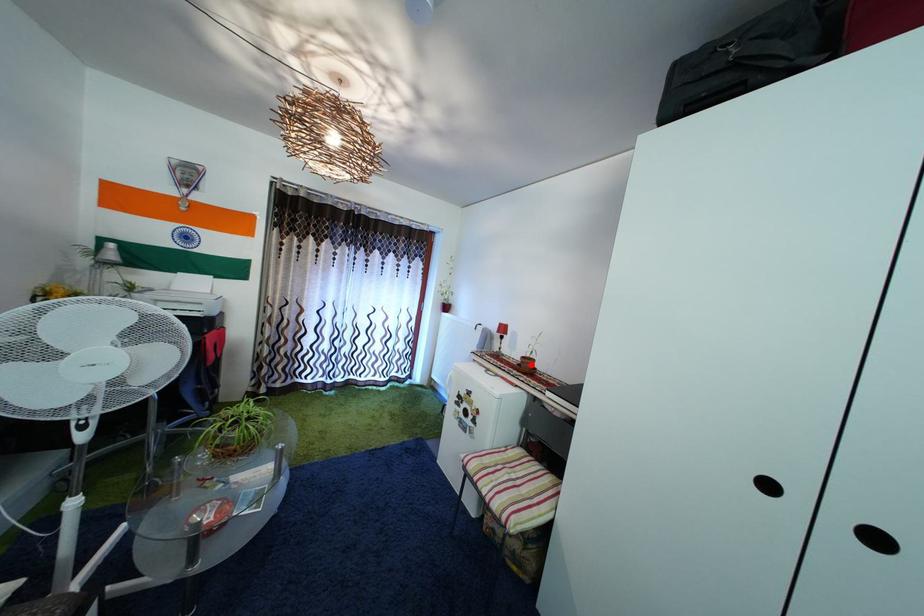
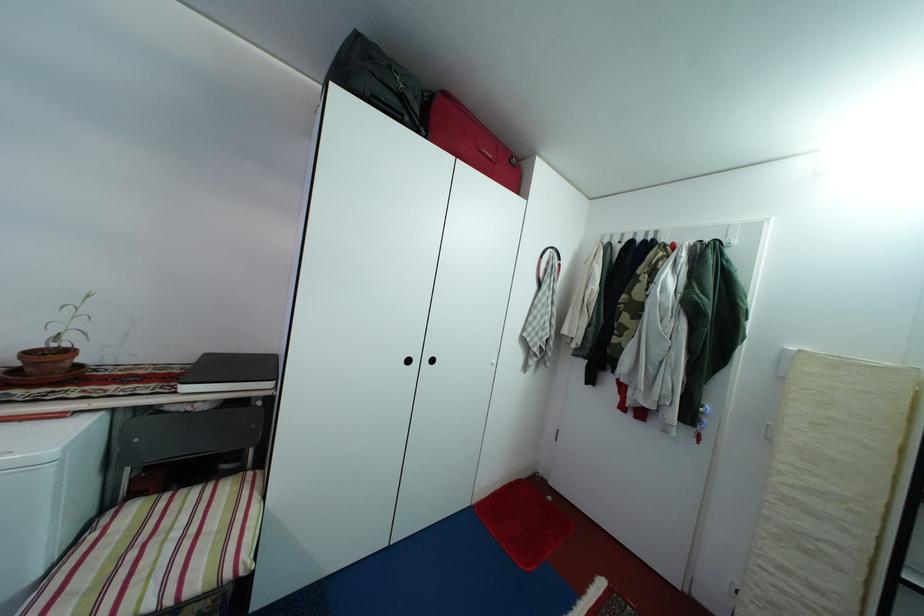
The point at the highlighted location is marked in the first image. Where is the corresponding point in the second image?

(38, 361)